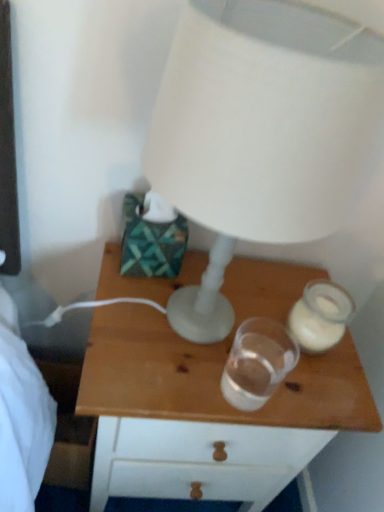
Question: Considering the relative sizes of translucent glass candle holder at right, the second candle holder viewed from the left, and transparent glass at center, positioned as the second candle holder in right-to-left order, in the image provided, is translucent glass candle holder at right, the second candle holder viewed from the left, wider than transparent glass at center, positioned as the second candle holder in right-to-left order,?

Choices:
 (A) no
 (B) yes

Answer: (B)

Question: Is translucent glass candle holder at right, the first candle holder in the right-to-left sequence, behind transparent glass at center, the first candle holder positioned from the left?

Choices:
 (A) yes
 (B) no

Answer: (A)

Question: Considering the relative sizes of translucent glass candle holder at right, the first candle holder in the right-to-left sequence, and transparent glass at center, positioned as the second candle holder in right-to-left order, in the image provided, is translucent glass candle holder at right, the first candle holder in the right-to-left sequence, smaller than transparent glass at center, positioned as the second candle holder in right-to-left order,?

Choices:
 (A) yes
 (B) no

Answer: (B)

Question: Is translucent glass candle holder at right, the second candle holder viewed from the left, outside transparent glass at center, positioned as the second candle holder in right-to-left order?

Choices:
 (A) yes
 (B) no

Answer: (A)

Question: Is there a large distance between translucent glass candle holder at right, the second candle holder viewed from the left, and transparent glass at center, the first candle holder positioned from the left?

Choices:
 (A) no
 (B) yes

Answer: (A)

Question: Is translucent glass candle holder at right, the second candle holder viewed from the left, to the right of transparent glass at center, the first candle holder positioned from the left, from the viewer's perspective?

Choices:
 (A) no
 (B) yes

Answer: (B)

Question: Does translucent glass candle holder at right, the first candle holder in the right-to-left sequence, have a lesser height compared to white matte lamp at upper center?

Choices:
 (A) yes
 (B) no

Answer: (A)

Question: From a real-world perspective, is translucent glass candle holder at right, the first candle holder in the right-to-left sequence, on top of white matte lamp at upper center?

Choices:
 (A) no
 (B) yes

Answer: (A)

Question: Is translucent glass candle holder at right, the second candle holder viewed from the left, turned away from white matte lamp at upper center?

Choices:
 (A) no
 (B) yes

Answer: (A)

Question: From a real-world perspective, does translucent glass candle holder at right, the first candle holder in the right-to-left sequence, sit lower than white matte lamp at upper center?

Choices:
 (A) yes
 (B) no

Answer: (A)

Question: Can you confirm if translucent glass candle holder at right, the first candle holder in the right-to-left sequence, is bigger than white matte lamp at upper center?

Choices:
 (A) yes
 (B) no

Answer: (B)

Question: Considering the relative sizes of translucent glass candle holder at right, the second candle holder viewed from the left, and white matte lamp at upper center in the image provided, is translucent glass candle holder at right, the second candle holder viewed from the left, wider than white matte lamp at upper center?

Choices:
 (A) yes
 (B) no

Answer: (B)

Question: Is wooden nightstand at center at the right side of translucent glass candle holder at right, the second candle holder viewed from the left?

Choices:
 (A) yes
 (B) no

Answer: (B)